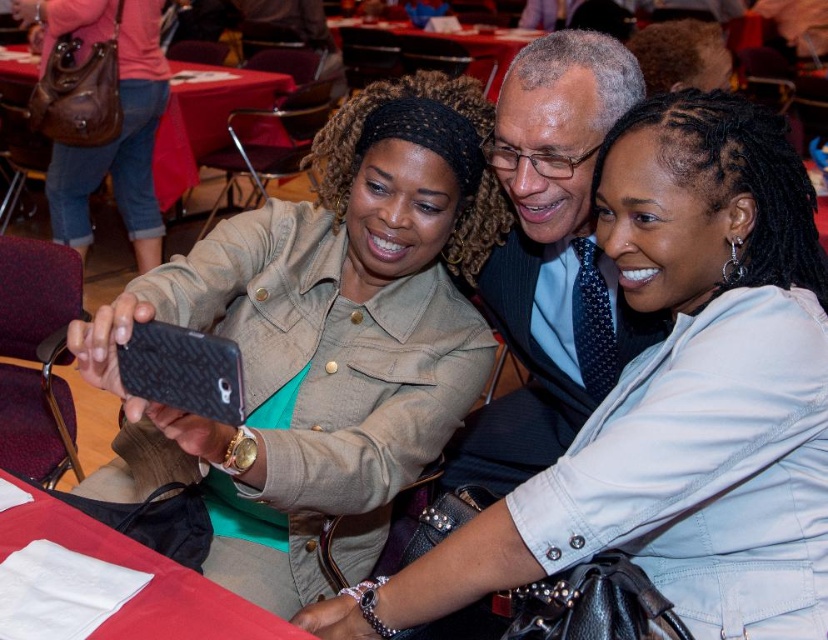
Question: Does red fabric table at lower left appear on the right side of red fabric table at upper left?

Choices:
 (A) yes
 (B) no

Answer: (A)

Question: Among these points, which one is farthest from the camera?

Choices:
 (A) (634, 189)
 (B) (530, 272)
 (C) (71, 100)
 (D) (198, 76)

Answer: (D)

Question: Based on their relative distances, which object is farther from the red cloth table at center?

Choices:
 (A) red fabric table at upper left
 (B) brown leather purse at upper left

Answer: (B)

Question: Which of these objects is positioned farthest from the red fabric table at lower left?

Choices:
 (A) matte khaki jacket at center
 (B) red cloth table at center
 (C) polished dark blue tie at center

Answer: (B)

Question: Is light beige jacket at center to the right of brown leather purse at upper left from the viewer's perspective?

Choices:
 (A) no
 (B) yes

Answer: (B)

Question: Can you confirm if light beige jacket at center is positioned to the right of red cloth table at center?

Choices:
 (A) yes
 (B) no

Answer: (A)